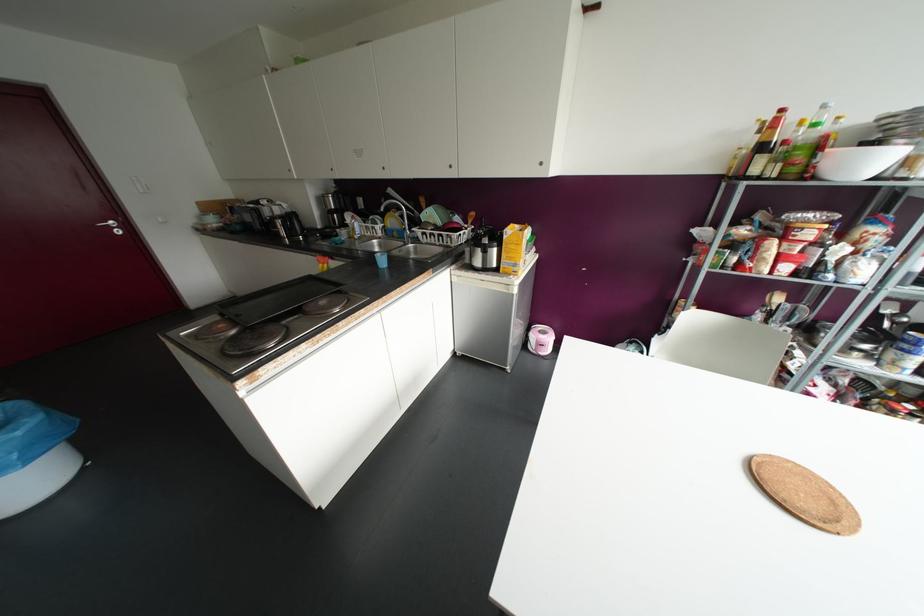
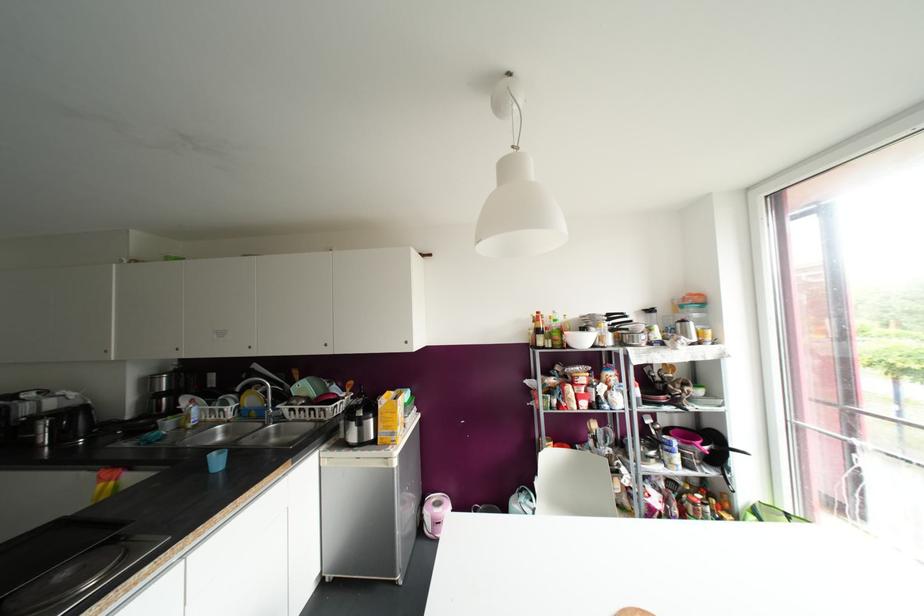
Consider the image. How did the camera likely rotate?

The camera rotated toward right-up.